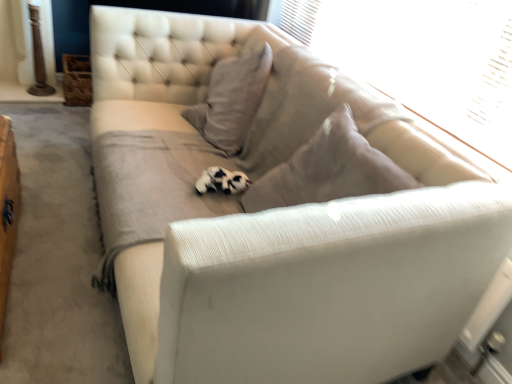
Question: Is transparent plastic window screen at upper right to the left of black and white fur at center from the viewer's perspective?

Choices:
 (A) yes
 (B) no

Answer: (B)

Question: Considering the relative sizes of transparent plastic window screen at upper right and black and white fur at center in the image provided, is transparent plastic window screen at upper right thinner than black and white fur at center?

Choices:
 (A) yes
 (B) no

Answer: (A)

Question: From a real-world perspective, is transparent plastic window screen at upper right positioned under black and white fur at center based on gravity?

Choices:
 (A) yes
 (B) no

Answer: (B)

Question: Is transparent plastic window screen at upper right facing towards black and white fur at center?

Choices:
 (A) yes
 (B) no

Answer: (B)

Question: Does transparent plastic window screen at upper right have a lesser height compared to black and white fur at center?

Choices:
 (A) no
 (B) yes

Answer: (A)

Question: Does transparent plastic window screen at upper right have a larger size compared to black and white fur at center?

Choices:
 (A) no
 (B) yes

Answer: (B)

Question: Is black and white fur at center aimed at transparent plastic window screen at upper right?

Choices:
 (A) yes
 (B) no

Answer: (B)

Question: Considering the relative sizes of black and white fur at center and transparent plastic window screen at upper right in the image provided, is black and white fur at center wider than transparent plastic window screen at upper right?

Choices:
 (A) yes
 (B) no

Answer: (A)

Question: Is black and white fur at center thinner than transparent plastic window screen at upper right?

Choices:
 (A) yes
 (B) no

Answer: (B)

Question: Can you confirm if black and white fur at center is positioned to the right of transparent plastic window screen at upper right?

Choices:
 (A) yes
 (B) no

Answer: (B)

Question: From the image's perspective, would you say black and white fur at center is positioned over transparent plastic window screen at upper right?

Choices:
 (A) no
 (B) yes

Answer: (A)

Question: Can you confirm if black and white fur at center is shorter than transparent plastic window screen at upper right?

Choices:
 (A) yes
 (B) no

Answer: (A)

Question: Does point pyautogui.click(x=451, y=91) appear closer or farther from the camera than point pyautogui.click(x=225, y=185)?

Choices:
 (A) farther
 (B) closer

Answer: (A)